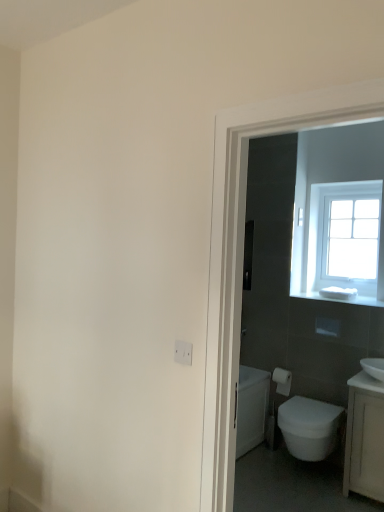
Question: Should I look upward or downward to see white matte toilet paper at right?

Choices:
 (A) down
 (B) up

Answer: (A)

Question: From a real-world perspective, does white glossy bidet at lower right sit lower than white matte toilet paper at right?

Choices:
 (A) no
 (B) yes

Answer: (B)

Question: Is white glossy bidet at lower right positioned with its back to white matte toilet paper at right?

Choices:
 (A) no
 (B) yes

Answer: (A)

Question: Is white glossy bidet at lower right not within white matte toilet paper at right?

Choices:
 (A) yes
 (B) no

Answer: (A)

Question: Does white glossy bidet at lower right have a greater width compared to white matte toilet paper at right?

Choices:
 (A) no
 (B) yes

Answer: (B)

Question: Is white glossy bidet at lower right taller than white matte toilet paper at right?

Choices:
 (A) yes
 (B) no

Answer: (A)

Question: From the image's perspective, is white glossy bidet at lower right under white matte toilet paper at right?

Choices:
 (A) no
 (B) yes

Answer: (B)

Question: Can you confirm if white glossy sink at right is bigger than white plastic electric outlet at lower center?

Choices:
 (A) no
 (B) yes

Answer: (B)

Question: Could you tell me if white glossy sink at right is facing white plastic electric outlet at lower center?

Choices:
 (A) yes
 (B) no

Answer: (A)

Question: Considering the relative sizes of white glossy sink at right and white plastic electric outlet at lower center in the image provided, is white glossy sink at right thinner than white plastic electric outlet at lower center?

Choices:
 (A) yes
 (B) no

Answer: (B)

Question: Would you say white glossy sink at right is outside white plastic electric outlet at lower center?

Choices:
 (A) no
 (B) yes

Answer: (B)

Question: Considering the relative positions of white glossy sink at right and white plastic electric outlet at lower center in the image provided, is white glossy sink at right behind white plastic electric outlet at lower center?

Choices:
 (A) yes
 (B) no

Answer: (A)

Question: From a real-world perspective, is white glossy sink at right on top of white plastic electric outlet at lower center?

Choices:
 (A) no
 (B) yes

Answer: (A)

Question: Can you confirm if white matte toilet paper at right is bigger than white plastic electric outlet at lower center?

Choices:
 (A) no
 (B) yes

Answer: (B)